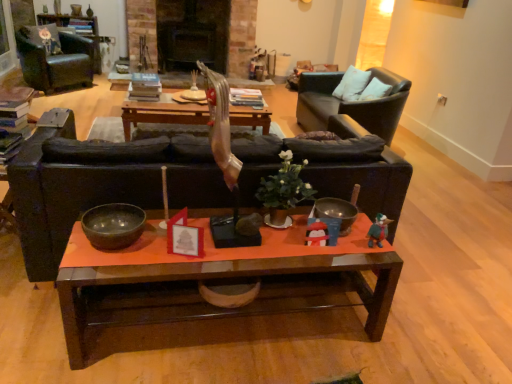
Locate an element on the screen. blank space to the left of plush green duck at right is located at coordinates (350, 249).